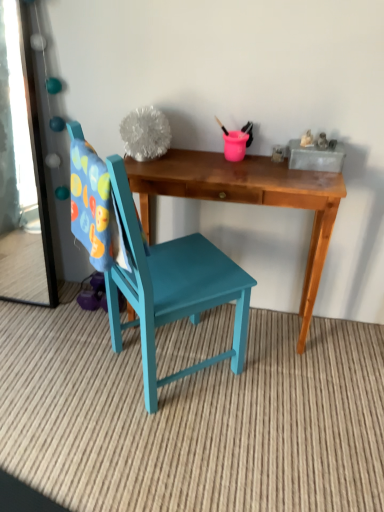
Question: Is clear glass mirror at left looking in the opposite direction of teal painted wood chair at center?

Choices:
 (A) yes
 (B) no

Answer: (B)

Question: Can you confirm if clear glass mirror at left is bigger than teal painted wood chair at center?

Choices:
 (A) yes
 (B) no

Answer: (B)

Question: Does clear glass mirror at left have a lesser width compared to teal painted wood chair at center?

Choices:
 (A) yes
 (B) no

Answer: (A)

Question: Can you confirm if clear glass mirror at left is smaller than teal painted wood chair at center?

Choices:
 (A) no
 (B) yes

Answer: (B)

Question: From the image's perspective, is clear glass mirror at left on top of teal painted wood chair at center?

Choices:
 (A) no
 (B) yes

Answer: (B)

Question: Considering the positions of wooden desk at center and teal painted wood chair at center in the image, is wooden desk at center bigger or smaller than teal painted wood chair at center?

Choices:
 (A) big
 (B) small

Answer: (B)

Question: Does point (173, 163) appear closer or farther from the camera than point (216, 355)?

Choices:
 (A) farther
 (B) closer

Answer: (B)

Question: Is wooden desk at center situated inside teal painted wood chair at center or outside?

Choices:
 (A) inside
 (B) outside

Answer: (B)

Question: From the image's perspective, is wooden desk at center located above or below teal painted wood chair at center?

Choices:
 (A) below
 (B) above

Answer: (B)

Question: From the image's perspective, relative to wooden desk at center, is teal painted wood chair at center above or below?

Choices:
 (A) below
 (B) above

Answer: (A)

Question: Is teal painted wood chair at center in front of or behind wooden desk at center in the image?

Choices:
 (A) behind
 (B) front

Answer: (B)

Question: Choose the correct answer: Is teal painted wood chair at center inside wooden desk at center or outside it?

Choices:
 (A) inside
 (B) outside

Answer: (B)

Question: Based on their sizes in the image, would you say teal painted wood chair at center is bigger or smaller than wooden desk at center?

Choices:
 (A) big
 (B) small

Answer: (A)

Question: Considering the positions of clear glass mirror at left and teal painted wood chair at center in the image, is clear glass mirror at left taller or shorter than teal painted wood chair at center?

Choices:
 (A) short
 (B) tall

Answer: (A)

Question: From a real-world perspective, is clear glass mirror at left physically located above or below teal painted wood chair at center?

Choices:
 (A) above
 (B) below

Answer: (A)